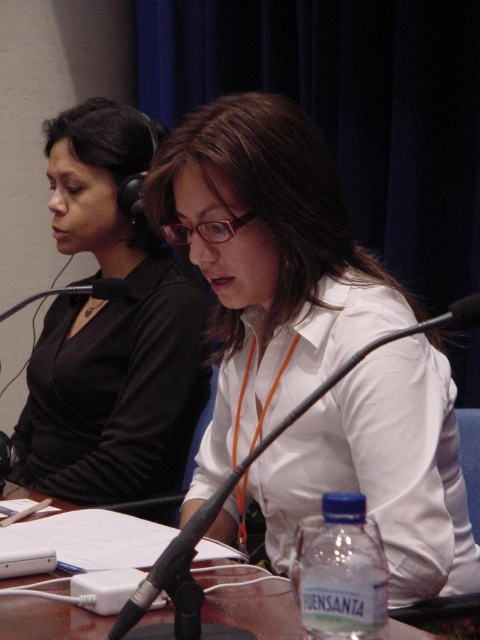
Question: Estimate the real-world distances between objects in this image. Which object is farther from the matte black shirt at center?

Choices:
 (A) white glossy shirt at center
 (B) brown wooden table at center

Answer: (B)

Question: Which of the following is the closest to the observer?

Choices:
 (A) brown wooden table at center
 (B) matte black shirt at center
 (C) white glossy shirt at center

Answer: (A)

Question: Does white glossy shirt at center appear under brown wooden table at center?

Choices:
 (A) yes
 (B) no

Answer: (B)

Question: Is white glossy shirt at center smaller than brown wooden table at center?

Choices:
 (A) yes
 (B) no

Answer: (B)

Question: Which of these objects is positioned farthest from the matte black shirt at center?

Choices:
 (A) white glossy shirt at center
 (B) brown wooden table at center

Answer: (B)

Question: Is white glossy shirt at center further to the viewer compared to matte black shirt at center?

Choices:
 (A) no
 (B) yes

Answer: (A)